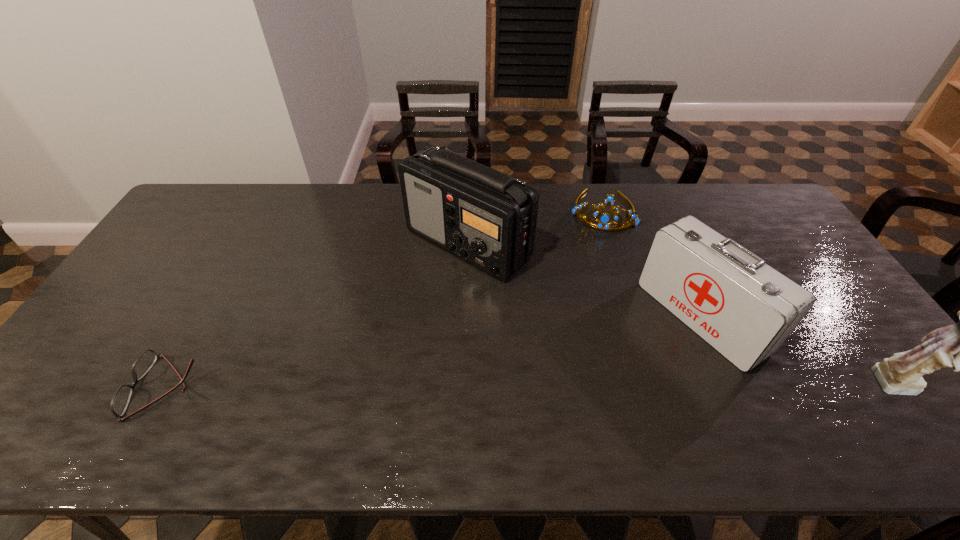
Image resolution: width=960 pixels, height=540 pixels. Find the location of `vacant area that lies between the radio receiver and the spectacles`. vacant area that lies between the radio receiver and the spectacles is located at coordinates (318, 315).

Find the location of a particular element. The image size is (960, 540). free spot between the second object from left to right and the spectacles is located at coordinates (318, 315).

Image resolution: width=960 pixels, height=540 pixels. Identify the location of free spot between the shortest object and the second object from left to right. (318, 315).

You are a GUI agent. You are given a task and a screenshot of the screen. Output one action in this format:
    pyautogui.click(x=<x>, y=<y>)
    Task: Click on the vacant area that lies between the spectacles and the first-aid kit
    
    Given the screenshot: What is the action you would take?
    pyautogui.click(x=434, y=352)

Locate an element on the screen. This screenshot has height=540, width=960. unoccupied area between the leftmost object and the figurine is located at coordinates (535, 387).

This screenshot has height=540, width=960. In order to click on vacant area that lies between the rightmost object and the leftmost object in this screenshot , I will do `click(535, 387)`.

Locate which object ranks third in proximity to the tiara. Please provide its 2D coordinates. Your answer should be formatted as a tuple, i.e. [(x, y)], where the tuple contains the x and y coordinates of a point satisfying the conditions above.

[(901, 374)]

Locate which object ranks third in proximity to the leftmost object. Please provide its 2D coordinates. Your answer should be formatted as a tuple, i.e. [(x, y)], where the tuple contains the x and y coordinates of a point satisfying the conditions above.

[(745, 309)]

Find the location of a particular element. This screenshot has height=540, width=960. vacant space that satisfies the following two spatial constraints: 1. on the back side of the radio receiver; 2. on the right side of the fourth tallest object is located at coordinates (468, 210).

What are the coordinates of `blank area in the image that satisfies the following two spatial constraints: 1. on the front side of the third tallest object; 2. on the front-facing side of the figurine` in the screenshot? It's located at (732, 387).